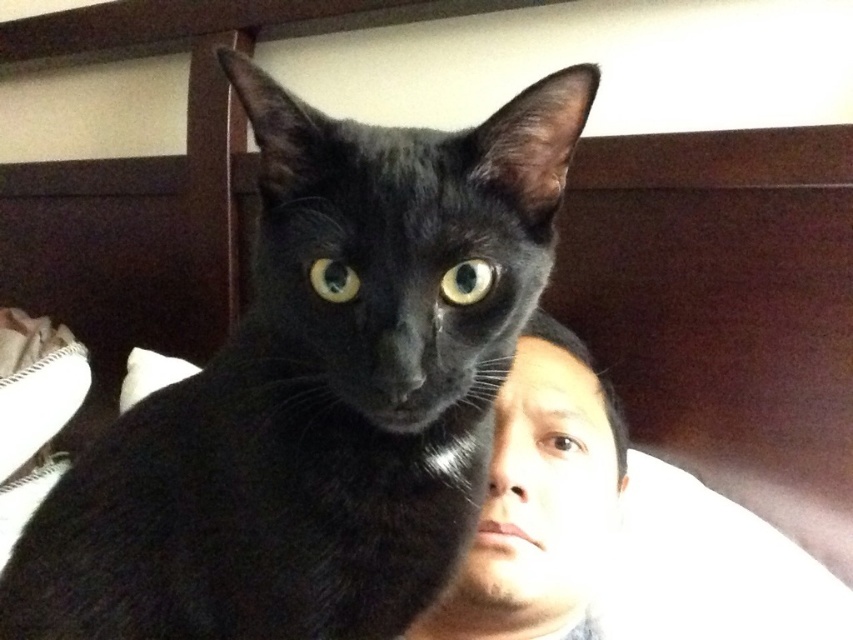
Question: Does black glossy cat at center have a greater width compared to smooth skin face at center?

Choices:
 (A) yes
 (B) no

Answer: (A)

Question: Among these points, which one is nearest to the camera?

Choices:
 (A) (585, 588)
 (B) (425, 404)

Answer: (B)

Question: Does black glossy cat at center have a lesser width compared to smooth skin face at center?

Choices:
 (A) no
 (B) yes

Answer: (A)

Question: Can you confirm if black glossy cat at center is positioned below smooth skin face at center?

Choices:
 (A) yes
 (B) no

Answer: (B)

Question: Which of the following is the farthest from the observer?

Choices:
 (A) smooth skin face at center
 (B) black glossy cat at center

Answer: (A)